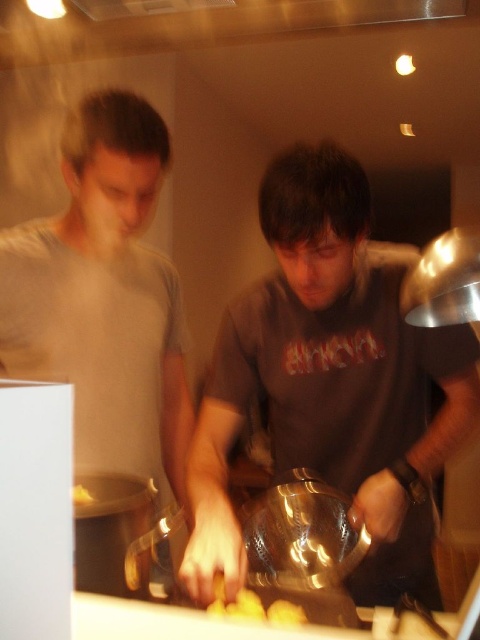
Based on the photo, based on the scene description, can you determine if the matte gray shirt at center is positioned higher than the yellow matte potato at center?

Yes, the matte gray shirt at center is positioned above the yellow matte potato at center according to the description.

You are standing in the kitchen and want to hand a potato to the person at point (267, 346). Can you reach them without moving your feet?

The distance between you and the person at point (267, 346) is 3.66 feet. Since the average human arm length is about 2.5 feet, you cannot reach them without moving closer.